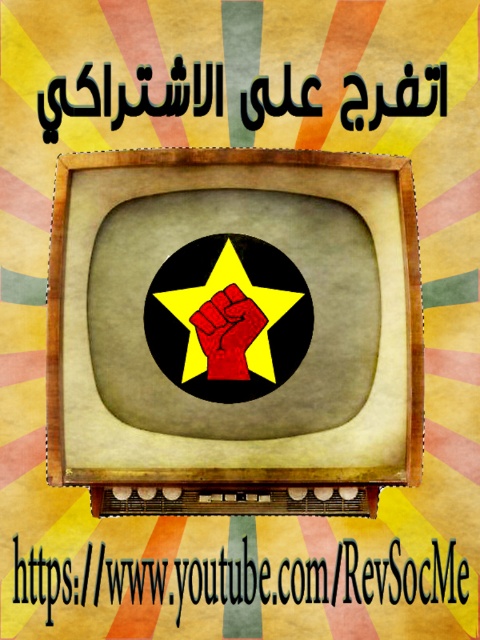
Is yellow matte star at center further to the viewer compared to red matte/felt hand at center?

That is False.

Is point (285, 310) less distant than point (242, 292)?

No, (285, 310) is behind (242, 292).

What are the coordinates of `yellow matte star at center` in the screenshot? It's located at (210, 298).